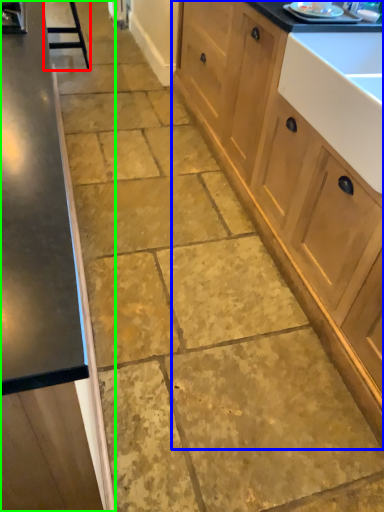
Question: Estimate the real-world distances between objects in this image. Which object is farther from bar stool (highlighted by a red box), cabinetry (highlighted by a blue box) or cabinetry (highlighted by a green box)?

Choices:
 (A) cabinetry
 (B) cabinetry

Answer: (B)